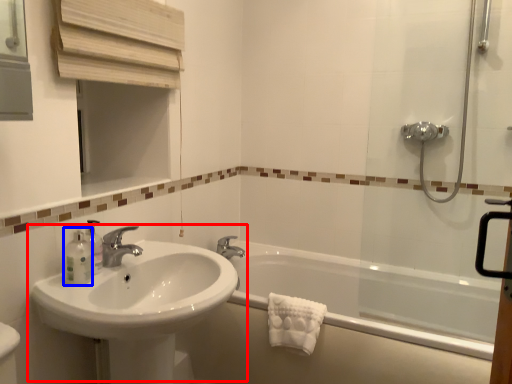
Question: Among these objects, which one is nearest to the camera, sink (highlighted by a red box) or toiletry (highlighted by a blue box)?

Choices:
 (A) sink
 (B) toiletry

Answer: (A)